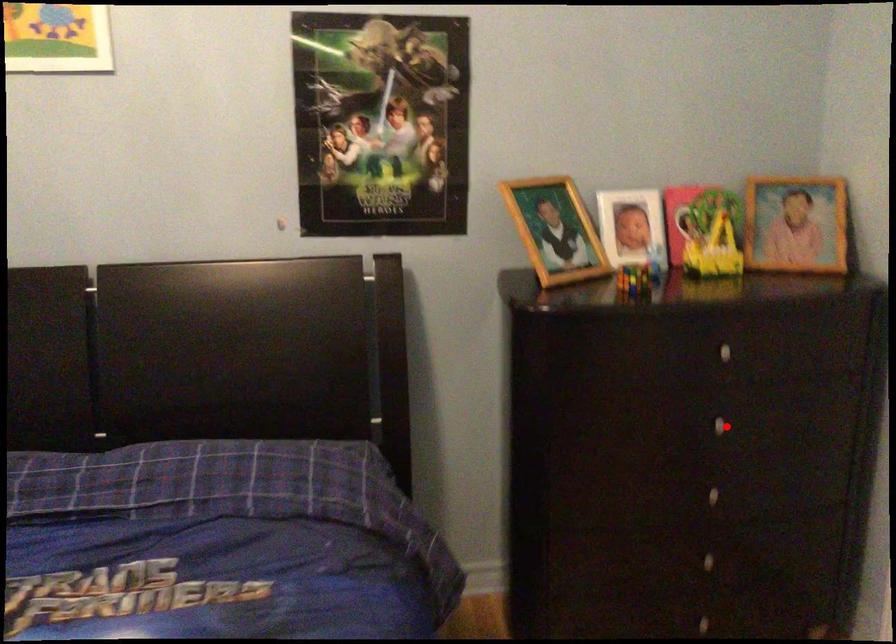
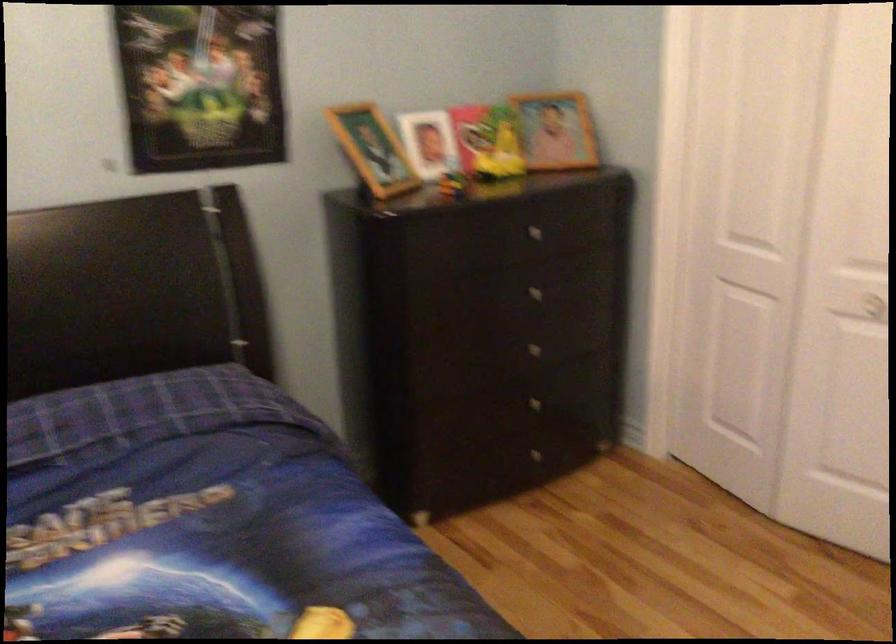
Locate, in the second image, the point that corresponds to the highlighted location in the first image.

(538, 292)